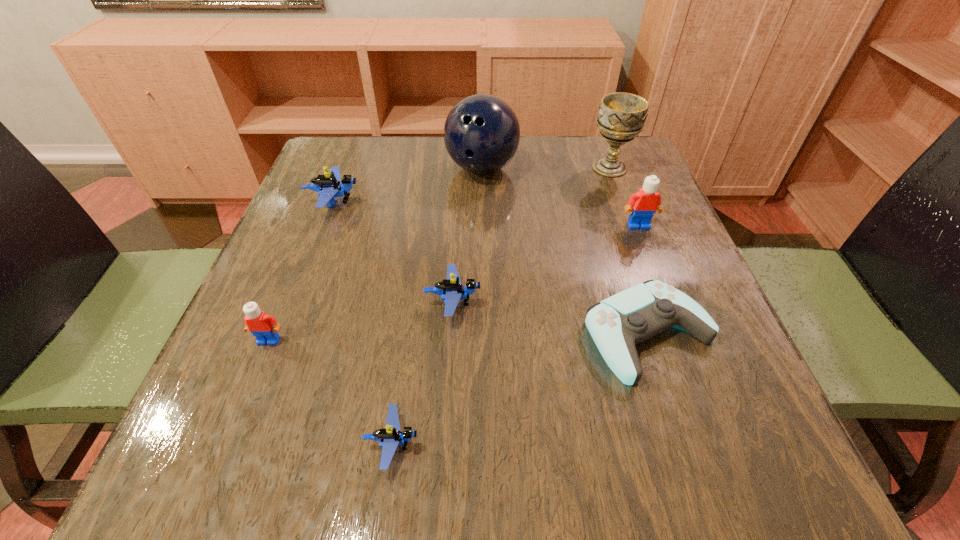
Image resolution: width=960 pixels, height=540 pixels. Identify the location of free spot located on the front-facing side of the shortest Lego. (683, 443).

In order to click on bowling ball located in the far edge section of the desktop in this screenshot , I will do `click(481, 134)`.

Locate an element on the screen. The width and height of the screenshot is (960, 540). chalice positioned at the far edge is located at coordinates (622, 116).

The width and height of the screenshot is (960, 540). In order to click on Lego that is at the far edge in this screenshot , I will do `click(329, 186)`.

The width and height of the screenshot is (960, 540). In order to click on object situated at the near edge in this screenshot , I will do `click(390, 437)`.

Where is `chalice that is positioned at the right edge`? The width and height of the screenshot is (960, 540). chalice that is positioned at the right edge is located at coordinates (622, 116).

You are a GUI agent. You are given a task and a screenshot of the screen. Output one action in this format:
    pyautogui.click(x=<x>, y=<y>)
    Task: Click on the Lego at the right edge
    The height and width of the screenshot is (540, 960).
    Given the screenshot: What is the action you would take?
    pyautogui.click(x=647, y=200)

You are a GUI agent. You are given a task and a screenshot of the screen. Output one action in this format:
    pyautogui.click(x=<x>, y=<y>)
    Task: Click on the control located in the right edge section of the desktop
    
    Given the screenshot: What is the action you would take?
    pyautogui.click(x=616, y=324)

Locate an element on the screen. object that is at the far left corner is located at coordinates (329, 186).

At what (x,y) coordinates should I click in order to perform the action: click on object at the far right corner. Please return your answer as a coordinate pair (x, y). Looking at the image, I should click on [x=622, y=116].